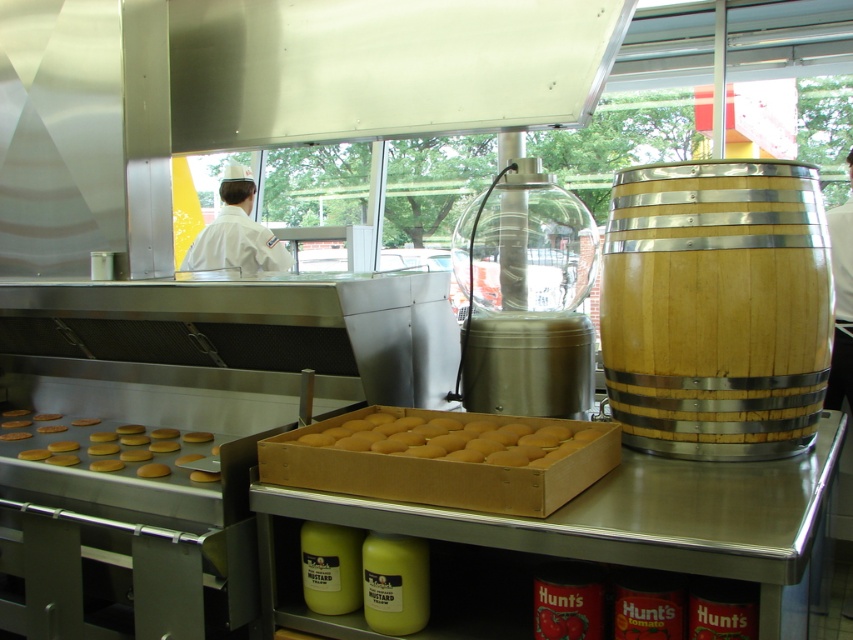
You are a delivery person who needs to place a new wooden barrel at the same location as the existing wooden barrel at right. According to the coordinates provided, where should you position the new wooden barrel?

The wooden barrel at right should be positioned at coordinates point [717,308] as specified in the description.

You are a food service worker who needs to reach the golden matte cookies at lower left to place them on a customer order. The customer is standing 5 feet away from the counter. Can you safely retrieve the cookies without moving closer to the counter?

The golden matte cookies at lower left are 4.80 feet away from the camera. Since the customer is 5 feet away from the counter, you can safely retrieve the cookies without moving closer to the counter because the distance to the cookies is less than the customer distance.

You are a food service worker who needs to grab a hamburger bun from the golden matte hamburger buns at lower left and then pour some tomato sauce from the cans next to the wooden barrel at right. Given that you can only reach 1.2 meters, will you be able to reach both items without moving your position?

The golden matte hamburger buns at lower left and wooden barrel at right are 1.22 meters apart. Since your reach is only 1.2 meters, you cannot reach both items without moving your position because the distance between them exceeds your reach.